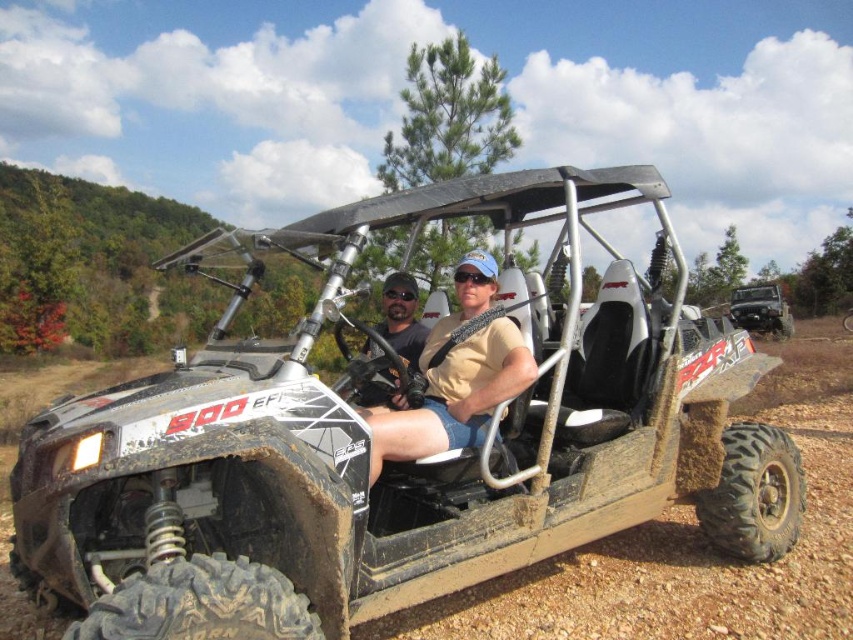
You are planning to transport a large piece of equipment that is 2 meters wide. You have a matte black golf cart at center and a tan fabric shirt at center available. Which object can accommodate the equipment based on their widths?

The matte black golf cart at center has a larger width than the tan fabric shirt at center, so the equipment can be placed on the matte black golf cart at center.

You are standing in front of the Polaris RZR 900 EFI UTV parked on the dirt trail. You notice two points marked on the vehicle. The first point is at coordinate point[515,342] and the second is at point[752,330]. Which point is closer to your current position?

Point[515,342] is closer to the camera than point[752,330], so the first point is closer to your current position.

You are a passenger in the UTV and need to locate your helmet and the Jeep. According to the scene, where is the matte black helmet at center relative to the brushed metal jeep at center?

The matte black helmet at center is to the left of the brushed metal jeep at center.